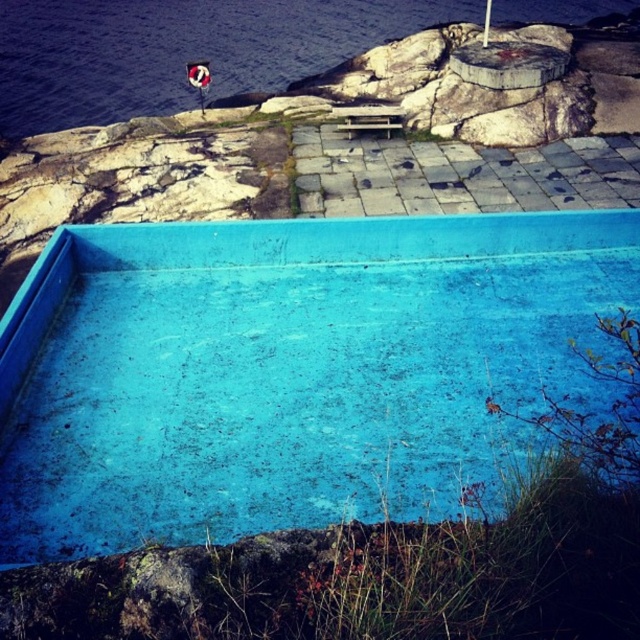
Question: Does blue matte pool at center come behind blue concrete water at upper left?

Choices:
 (A) no
 (B) yes

Answer: (A)

Question: From the image, what is the correct spatial relationship of blue matte pool at center in relation to blue concrete water at upper left?

Choices:
 (A) right
 (B) left

Answer: (A)

Question: Among these points, which one is farthest from the camera?

Choices:
 (A) (538, 1)
 (B) (401, 262)

Answer: (A)

Question: Does blue matte pool at center have a larger size compared to blue concrete water at upper left?

Choices:
 (A) yes
 (B) no

Answer: (B)